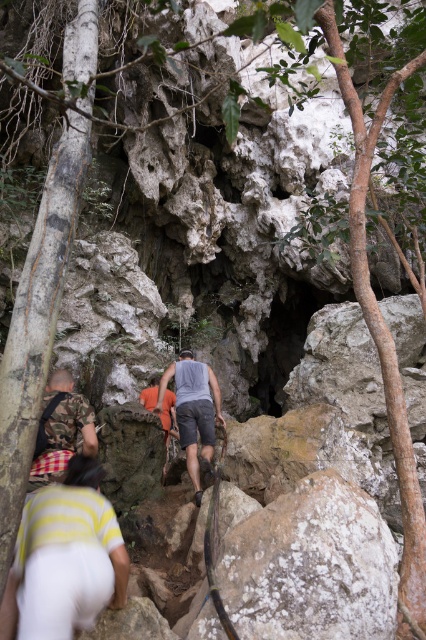
You are a photographer positioned at the entrance of the cave. You notice two people wearing the yellow striped shirt at lower left and the camo fabric shirt at lower left. Which of these two shirts is closer to the camera?

The yellow striped shirt at lower left is much taller as the camo fabric shirt at lower left, so the yellow striped shirt at lower left is closer to the camera.

You are a photographer trying to capture the entire group in a single shot. Given that the yellow striped shirt at lower left and the gray cotton tank top at center are part of the group, which clothing item should you focus on to ensure both are in frame?

Since the yellow striped shirt at lower left occupies less space than the gray cotton tank top at center, you should focus on the gray cotton tank top at center to ensure both are in frame as it takes up more area and will help frame the shot better.

You are a hiker trying to locate your friend wearing a yellow striped shirt at lower left in this rocky terrain. According to the coordinates provided, where exactly should you look to find them?

The yellow striped shirt at lower left is located at coordinates point (66, 560).